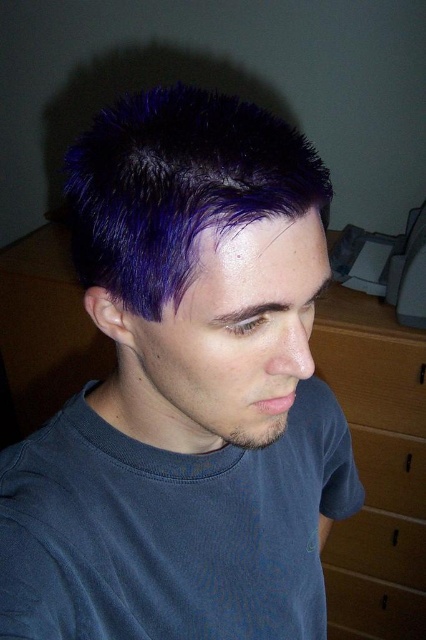
Between brown wood dresser at right and wooden drawer at lower right, which one is positioned higher?

wooden drawer at lower right is above.

Does brown wood dresser at right have a greater height compared to wooden drawer at lower right?

Correct, brown wood dresser at right is much taller as wooden drawer at lower right.

Who is more distant from viewer, (391, 339) or (402, 369)?

Positioned behind is point (402, 369).

You are a GUI agent. You are given a task and a screenshot of the screen. Output one action in this format:
    pyautogui.click(x=<x>, y=<y>)
    Task: Click on the brown wood dresser at right
    Image resolution: width=426 pixels, height=640 pixels.
    Given the screenshot: What is the action you would take?
    pyautogui.click(x=377, y=467)

Is purple matte hair at center closer to camera compared to brown wood dresser at right?

Yes, purple matte hair at center is in front of brown wood dresser at right.

The width and height of the screenshot is (426, 640). I want to click on purple matte hair at center, so pyautogui.click(x=186, y=392).

The height and width of the screenshot is (640, 426). Describe the element at coordinates (186, 392) in the screenshot. I see `purple matte hair at center` at that location.

You are a GUI agent. You are given a task and a screenshot of the screen. Output one action in this format:
    pyautogui.click(x=<x>, y=<y>)
    Task: Click on the purple matte hair at center
    Image resolution: width=426 pixels, height=640 pixels.
    Given the screenshot: What is the action you would take?
    pyautogui.click(x=186, y=392)

Is dark blue cotton t-shirt at lower center shorter than brown wood dresser at right?

Yes.

Does dark blue cotton t-shirt at lower center have a greater height compared to brown wood dresser at right?

Incorrect, dark blue cotton t-shirt at lower center's height is not larger of brown wood dresser at right's.

You are a GUI agent. You are given a task and a screenshot of the screen. Output one action in this format:
    pyautogui.click(x=<x>, y=<y>)
    Task: Click on the dark blue cotton t-shirt at lower center
    This screenshot has height=640, width=426.
    Given the screenshot: What is the action you would take?
    pyautogui.click(x=170, y=529)